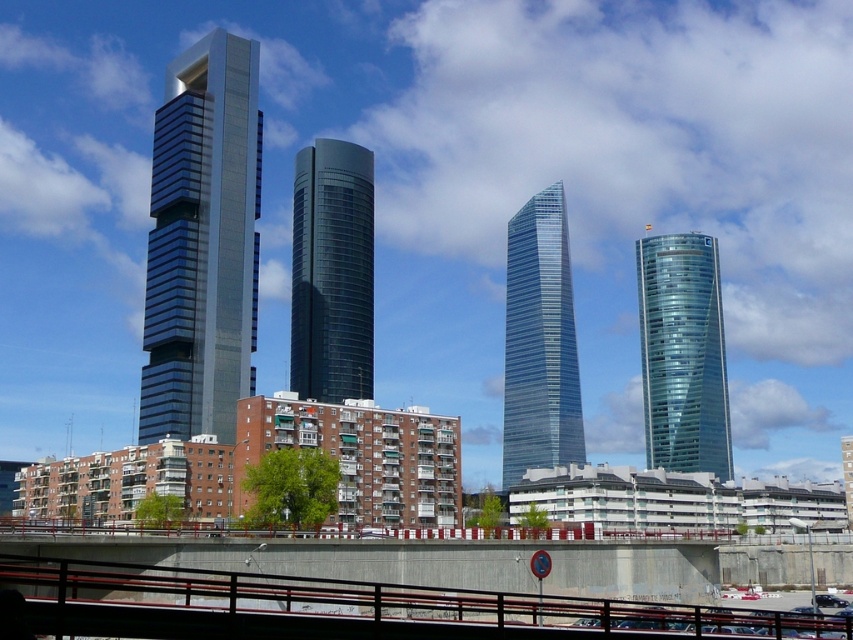
Is point (322, 396) less distant than point (549, 310)?

That is True.

Who is lower down, shiny glass tower at center or transparent glass skyscraper at center?

transparent glass skyscraper at center is lower down.

In order to click on shiny glass tower at center in this screenshot , I will do `click(332, 273)`.

Is transparent glass tower at right thinner than transparent glass skyscraper at center?

In fact, transparent glass tower at right might be wider than transparent glass skyscraper at center.

Who is more forward, (674, 252) or (518, 348)?

Point (518, 348) is in front.

Locate an element on the screen. transparent glass tower at right is located at coordinates (682, 355).

How distant is concrete bridge at lower center from shiny glass tower at center?

concrete bridge at lower center is 129.34 meters away from shiny glass tower at center.

Does concrete bridge at lower center appear under shiny glass tower at center?

Yes.

Identify the location of concrete bridge at lower center. This screenshot has width=853, height=640. (416, 561).

Find the location of a particular element. concrete bridge at lower center is located at coordinates (416, 561).